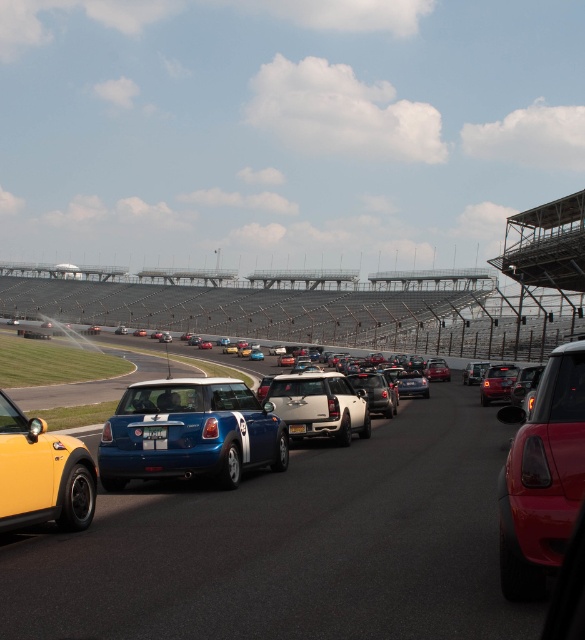
You are a photographer positioned at the starting line of the racetrack. You want to take a photo of the white plastic license plate at center without including the shiny yellow taxi at lower left in the frame. Is this possible given their positions?

The shiny yellow taxi at lower left is to the left of the white plastic license plate at center, so if you position yourself to the right side of the taxi, you can capture the license plate without the taxi appearing in the frame.

You are a photographer positioned at the center of the racetrack. You want to capture a photo of the shiny yellow taxi at lower left. Which direction should you point your camera to ensure the taxi is in the frame?

The shiny yellow taxi at lower left is located at point (43, 474), which is to the left side of the center. Therefore, you should point your camera to the left to capture the taxi in the frame.

You are a photographer positioned at the starting line of the racetrack. You want to take a photo that includes both the smooth asphalt race track at center and the yellow plastic license plate at center. Based on their positions, which object will appear closer to you in the photo?

The smooth asphalt race track at center is in front of the yellow plastic license plate at center, so it will appear closer to you in the photo.